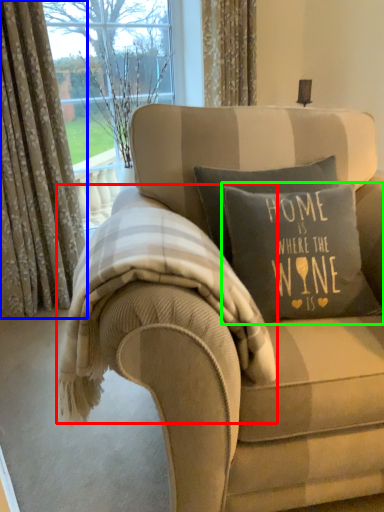
Question: Considering the real-world distances, which object is closest to bedding (highlighted by a red box)? curtain (highlighted by a blue box) or pillow (highlighted by a green box).

Choices:
 (A) curtain
 (B) pillow

Answer: (B)